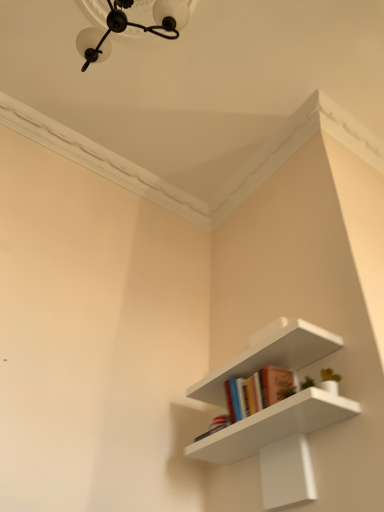
The width and height of the screenshot is (384, 512). Describe the element at coordinates (273, 426) in the screenshot. I see `white matte shelf at center` at that location.

Locate an element on the screen. The width and height of the screenshot is (384, 512). white matte shelf at center is located at coordinates (273, 426).

This screenshot has width=384, height=512. In order to click on white matte shelf at center in this screenshot , I will do pyautogui.click(x=273, y=426).